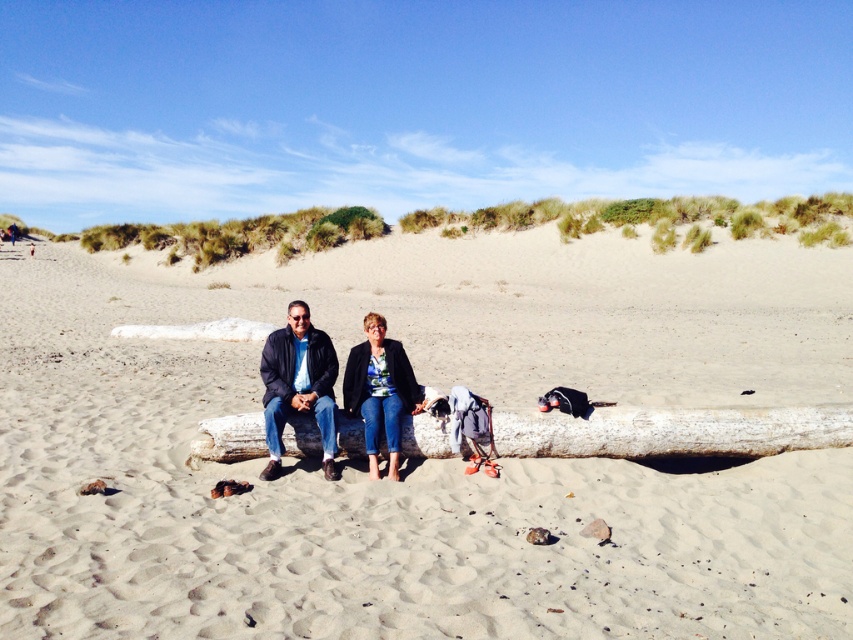
Question: Does matte black jacket at center appear over dark blue leather jacket at center?

Choices:
 (A) yes
 (B) no

Answer: (B)

Question: Estimate the real-world distances between objects in this image. Which object is closer to the dark blue leather jacket at center?

Choices:
 (A) smooth white log at center
 (B) denim jacket at center
 (C) matte black jacket at center

Answer: (C)

Question: Is smooth sand at center positioned in front of dark blue leather jacket at center?

Choices:
 (A) yes
 (B) no

Answer: (A)

Question: Can you confirm if smooth sand at center is positioned below dark blue leather jacket at center?

Choices:
 (A) no
 (B) yes

Answer: (A)

Question: Which point appears farthest from the camera in this image?

Choices:
 (A) (364, 417)
 (B) (624, 326)

Answer: (B)

Question: Which point is closer to the camera?

Choices:
 (A) dark blue leather jacket at center
 (B) smooth sand at center
 (C) denim jacket at center

Answer: (B)